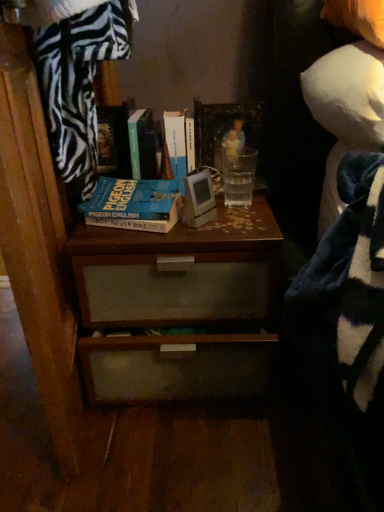
Question: Looking at their shapes, would you say white fabric doll at upper right is wider or thinner than brown wood chest of drawers at center?

Choices:
 (A) wide
 (B) thin

Answer: (B)

Question: From the image's perspective, relative to brown wood chest of drawers at center, is white fabric doll at upper right above or below?

Choices:
 (A) below
 (B) above

Answer: (B)

Question: Which is farther from the blue matte book at center, placed as the third book when sorted from right to left?

Choices:
 (A) zebra-patterned fabric at upper left
 (B) hardcover book at center, the 1th book positioned from the right
 (C) wooden picture frame at center
 (D) brown wood chest of drawers at center
 (E) green matte book at upper center, which is counted as the second book, starting from the right

Answer: (C)

Question: Based on their relative distances, which object is nearer to the white fabric doll at upper right?

Choices:
 (A) blue matte book at center, positioned as the 1th book in left-to-right order
 (B) green matte book at upper center, arranged as the 2th book when viewed from the left
 (C) brown wood chest of drawers at center
 (D) hardcover book at center, the 1th book positioned from the right
 (E) zebra-patterned fabric at upper left

Answer: (C)